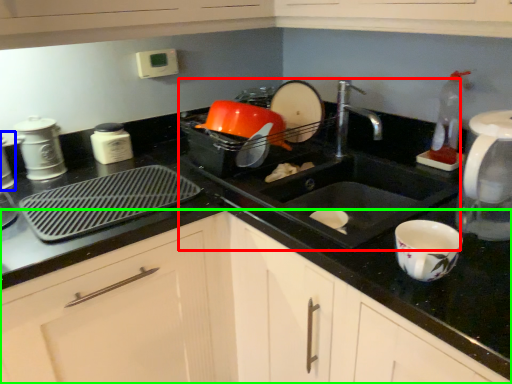
Question: Which is farther away from sink (highlighted by a red box)? appliance (highlighted by a blue box) or cabinetry (highlighted by a green box)?

Choices:
 (A) appliance
 (B) cabinetry

Answer: (A)